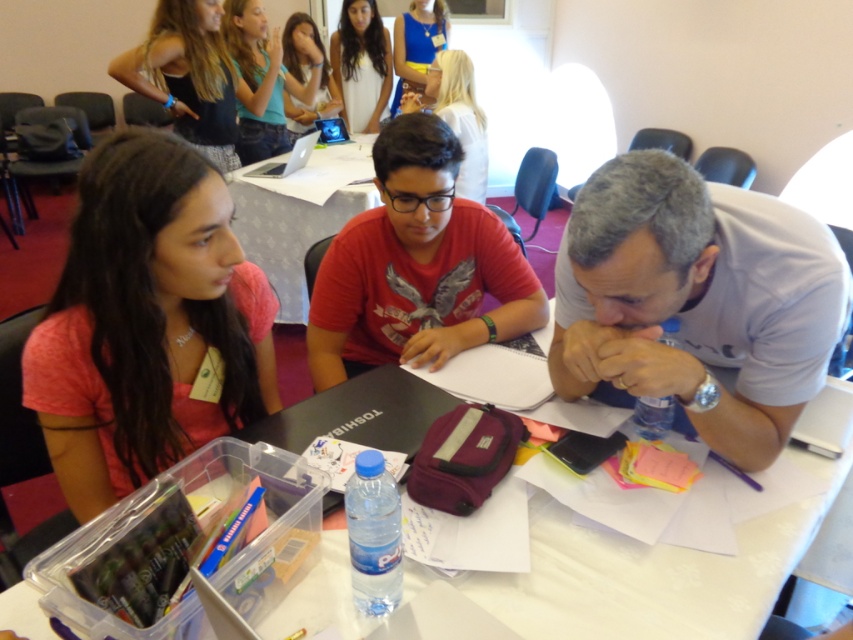
You are standing at the entrance of the room and want to greet the person in the pink matte shirt at left and the person at the black plastic table at center. Which one is closer to you?

The pink matte shirt at left is closer to you because it is to the right of the black plastic table at center, which places it nearer to the entrance.

You are organizing a small event and need to decide whether to place a decorative item on the white matte shirt at center or the clear plastic container at lower left. Based on their sizes, which one can accommodate a larger decorative item?

The clear plastic container at lower left can accommodate a larger decorative item since it has a bigger size compared to the white matte shirt at center.

You are standing in the room and want to take a photo of both point (573,234) and point (289,212). Which point should you focus on first to ensure both are in focus?

You should focus on point (289,212) first because it is farther from the camera than point (573,234), ensuring both will be in focus when focusing on the farther point.